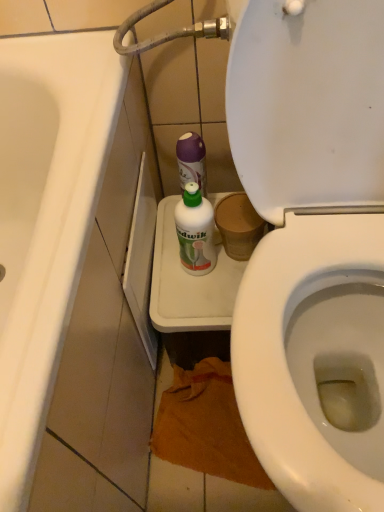
Question: Would you say white glossy bathtub at left is inside or outside white plastic bottle at center?

Choices:
 (A) outside
 (B) inside

Answer: (A)

Question: From a real-world perspective, is white glossy bathtub at left physically located above or below white plastic bottle at center?

Choices:
 (A) below
 (B) above

Answer: (A)

Question: Is white glossy bathtub at left wider or thinner than white plastic bottle at center?

Choices:
 (A) thin
 (B) wide

Answer: (B)

Question: In terms of height, does white plastic bottle at center look taller or shorter compared to white glossy bathtub at left?

Choices:
 (A) tall
 (B) short

Answer: (B)

Question: From a real-world perspective, is white plastic bottle at center physically located above or below white glossy bathtub at left?

Choices:
 (A) below
 (B) above

Answer: (B)

Question: From the image's perspective, is white plastic bottle at center located above or below white glossy bathtub at left?

Choices:
 (A) above
 (B) below

Answer: (A)

Question: Is white plastic bottle at center bigger or smaller than white glossy bathtub at left?

Choices:
 (A) big
 (B) small

Answer: (B)